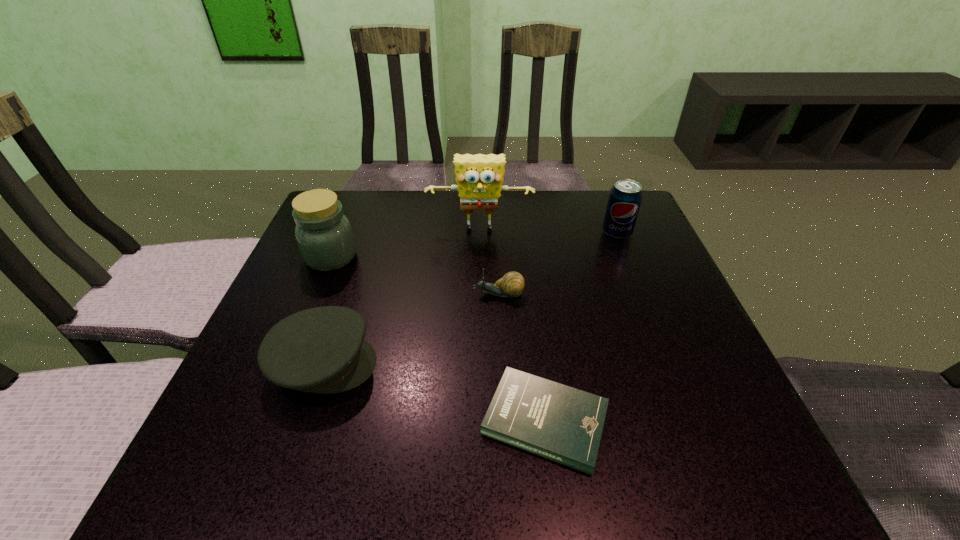
Image resolution: width=960 pixels, height=540 pixels. Identify the location of the tallest object. (479, 177).

What are the coordinates of `jar` in the screenshot? It's located at (324, 236).

Find the location of a particular element. the rightmost object is located at coordinates (625, 197).

Where is `soda can`? Image resolution: width=960 pixels, height=540 pixels. soda can is located at coordinates (625, 197).

Where is `beret`? The image size is (960, 540). beret is located at coordinates (322, 350).

Image resolution: width=960 pixels, height=540 pixels. I want to click on the fourth farthest object, so click(x=512, y=284).

Locate an element on the screen. The width and height of the screenshot is (960, 540). escargot is located at coordinates (512, 284).

Identify the location of book. The height and width of the screenshot is (540, 960). (564, 424).

Find the location of a particular element. This screenshot has width=960, height=540. vacant space situated 0.140m on the face of the tallest object is located at coordinates (480, 276).

Locate an element on the screen. This screenshot has height=540, width=960. free spot located on the back of the jar is located at coordinates click(x=348, y=217).